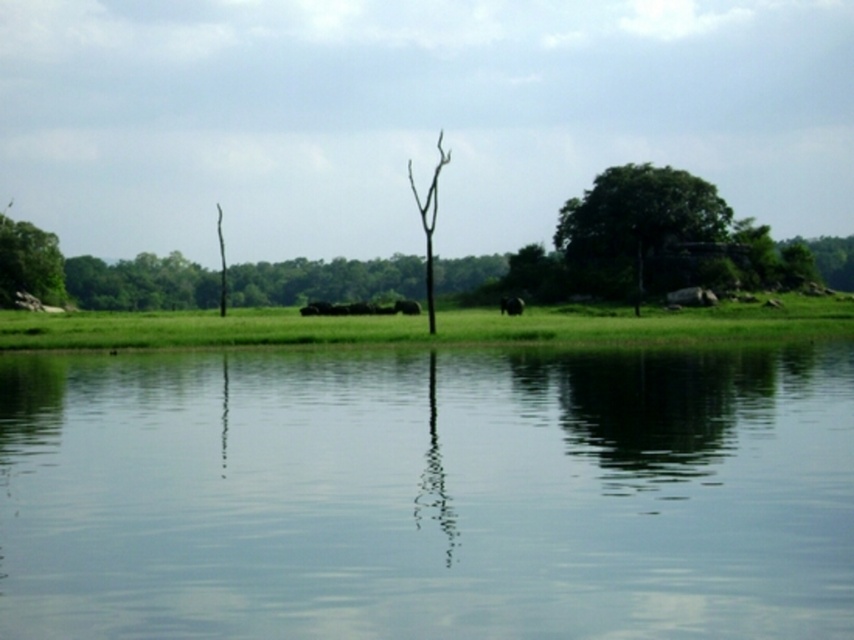
You are standing on the grassy area in the scene and see the green leafy tree at left and the brown fuzzy elephant at center. Which object is higher up in the image?

The green leafy tree at left is located above the brown fuzzy elephant at center, so it is higher up in the image.

You are an observer standing in the serene natural landscape. You see the transparent water at center and the brown furry elephant at center. Which object is higher up in the scene?

The transparent water at center is taller than the brown furry elephant at center, so the transparent water at center is higher up in the scene.

You are an artist trying to paint the scene. You need to decide which object to paint first based on their sizes. Which one should you start with, the green leafy tree at left or the brown fuzzy elephant at center?

The green leafy tree at left is wider than the brown fuzzy elephant at center, so you should start with the green leafy tree at left since it is larger in width and will require more time and detail.